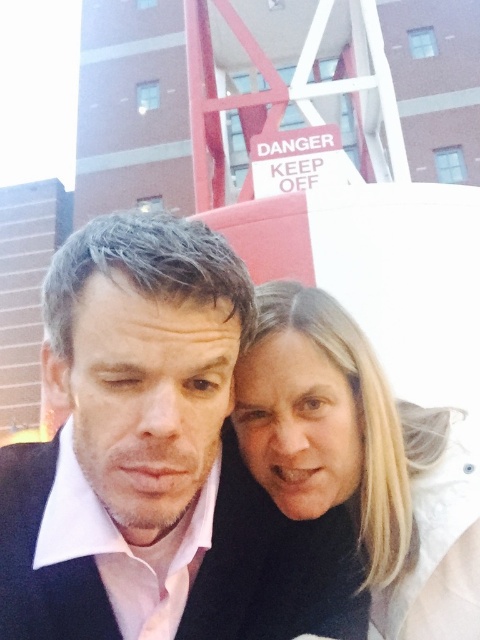
Which is more to the right, pink matte shirt at center or blonde hair at center?

blonde hair at center is more to the right.

Where is `pink matte shirt at center`? This screenshot has height=640, width=480. pink matte shirt at center is located at coordinates (156, 461).

Is blonde hair at center wider than black matte business suit at center?

No.

Which is above, blonde hair at center or black matte business suit at center?

blonde hair at center

Which is behind, point (267, 465) or point (226, 445)?

Positioned behind is point (226, 445).

What are the coordinates of `blonde hair at center` in the screenshot? It's located at (361, 460).

Can you confirm if pink matte shirt at center is taller than black matte business suit at center?

Indeed, pink matte shirt at center has a greater height compared to black matte business suit at center.

Which is above, pink matte shirt at center or black matte business suit at center?

pink matte shirt at center is above.

Locate an element on the screen. The height and width of the screenshot is (640, 480). pink matte shirt at center is located at coordinates (156, 461).